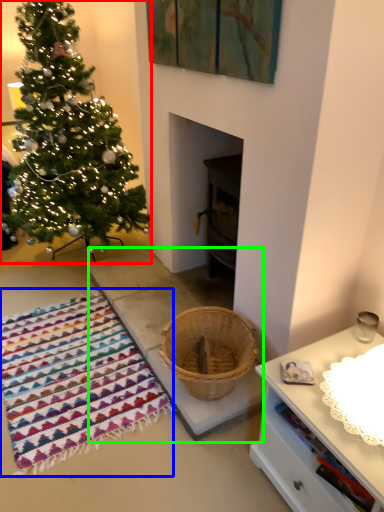
Question: Which object is positioned closest to christmas tree (highlighted by a red box)? Select from blanket (highlighted by a blue box) and concrete (highlighted by a green box).

Choices:
 (A) blanket
 (B) concrete

Answer: (B)